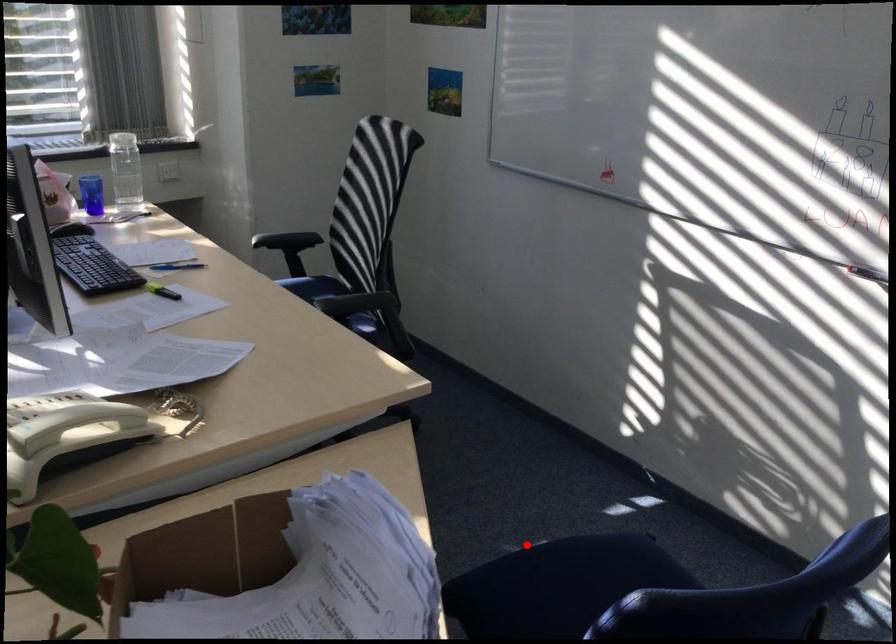
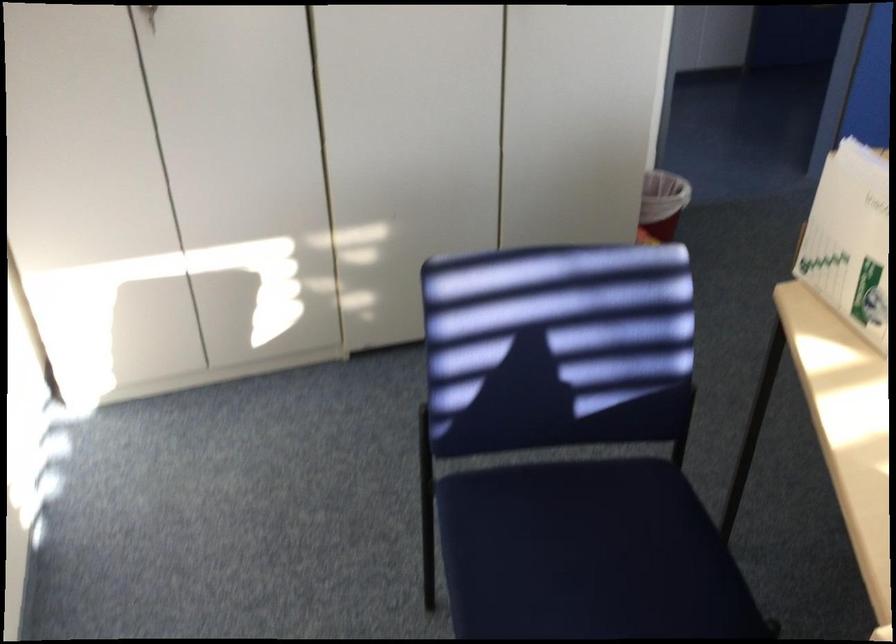
Question: I am providing you with two images of the same scene from different viewpoints. Image1 has a red point marked. In image2, the corresponding 3D location appears at what relative position? Reply with the corresponding letter.

Choices:
 (A) Closer
 (B) Farther

Answer: (A)